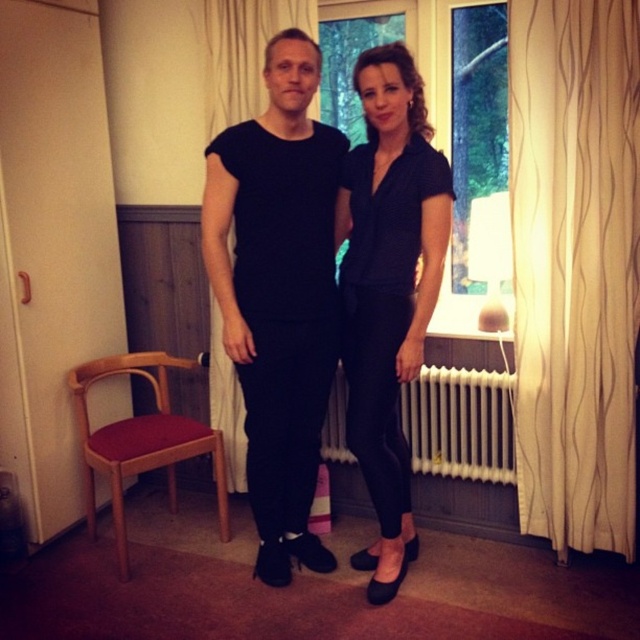
You are a photographer setting up a shoot in this room. You want to position a light stand so that it doesn not block the view of the black matte pants at center. Where should you place the light stand relative to the beige textured curtain at right?

The beige textured curtain at right is above the black matte pants at center, so placing the light stand below the beige textured curtain at right would avoid blocking the view of the black matte pants at center.

You are designing a layout for a catalog and need to place the black matte pants at center and the matte black blouse at center next to each other. Based on their sizes, which one should be placed higher on the page?

The black matte pants at center has a greater height compared to the matte black blouse at center, so it should be placed higher on the page to maintain visual balance.

You are trying to decide which item to move first in the room. Since the beige textured curtain at right is smaller than the black matte pants at center, which item requires more space to move around?

The black matte pants at center requires more space to move around because it is larger than the beige textured curtain at right.